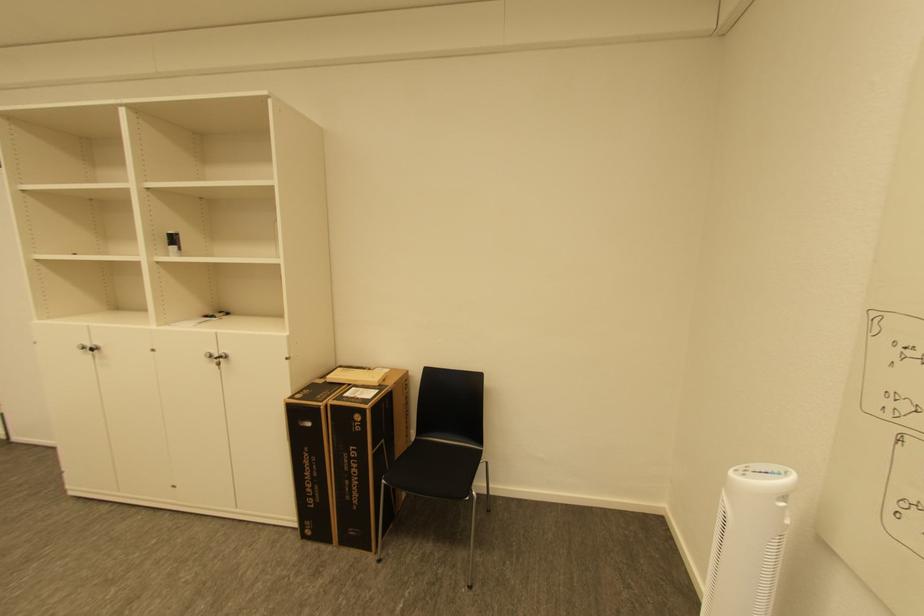
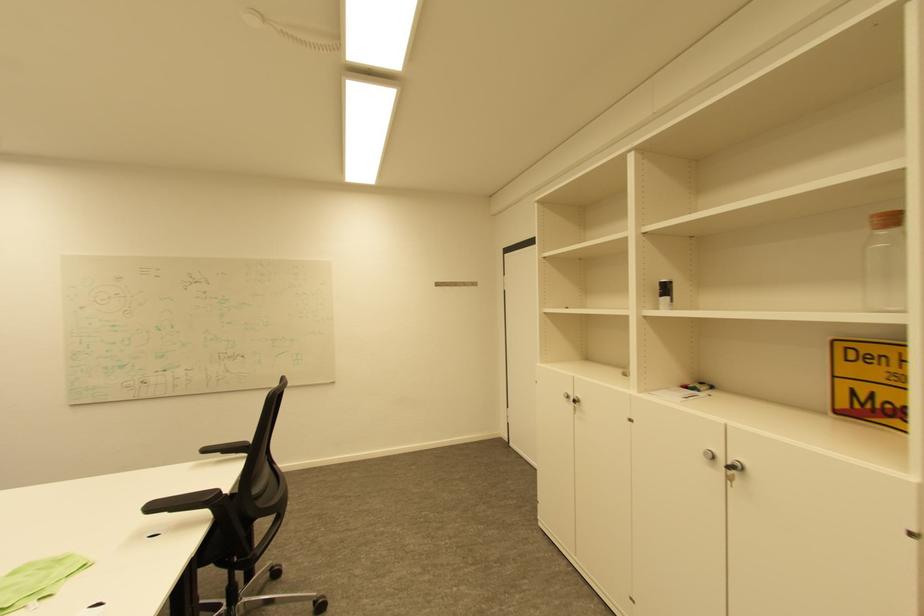
Question: The camera is either moving clockwise (left) or counter-clockwise (right) around the object. The first image is from the beginning of the video and the second image is from the end. Is the camera moving left or right when shooting the video?

Choices:
 (A) Left
 (B) Right

Answer: (B)